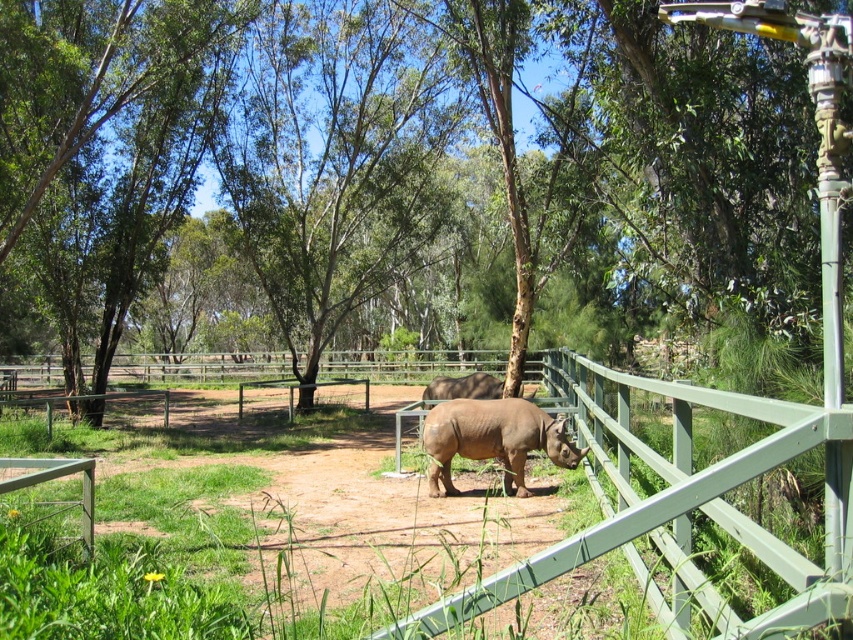
You are a zookeeper who needs to feed both the brown textured tree at center and the brown matte rhinoceros at center. Since you can only reach items that are below your eye level, which one should you prioritize feeding first?

The brown textured tree at center is located above the brown matte rhinoceros at center, so the zookeeper should prioritize feeding the brown matte rhinoceros at center first since it is at a lower position and within reach.

You are standing at the camera position and want to reach the point marked at coordinates (424, 138) in the image. The zoo requires visitors to stay at least 20 meters away from the rhinoceroses at all times. Can you safely walk to that point without violating the safety distance rule?

The distance between you and the point marked at coordinates (424, 138) is 22.21 meters, which is greater than the required 20 meters safety distance. Therefore, you can safely walk to that point without violating the zoo regulations.

You are a zookeeper planning to place a new feeding station in the enclosure. The feeding station must be placed at point coordinates of point (321, 168). According to the scene, what type of object is located at that point?

The point (321, 168) is on a brown textured tree at center, so the feeding station should be placed there on the brown textured tree at center.